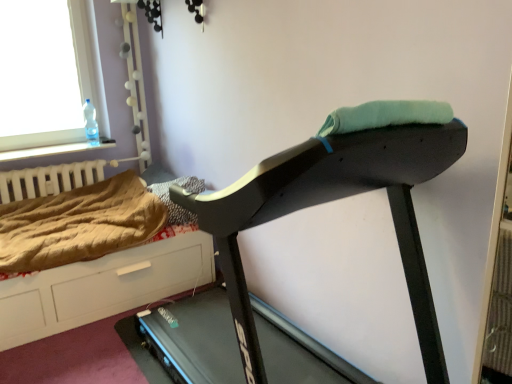
Question: In which direction should I rotate to look at brown textured blanket at center, which is the second blanket from left to right?

Choices:
 (A) left
 (B) right

Answer: (A)

Question: Is transparent glass window at upper left directly adjacent to brown wood dresser at lower left?

Choices:
 (A) no
 (B) yes

Answer: (A)

Question: Is transparent glass window at upper left positioned far away from brown wood dresser at lower left?

Choices:
 (A) no
 (B) yes

Answer: (B)

Question: Does transparent glass window at upper left have a larger size compared to brown wood dresser at lower left?

Choices:
 (A) no
 (B) yes

Answer: (A)

Question: Does transparent glass window at upper left have a lesser width compared to brown wood dresser at lower left?

Choices:
 (A) no
 (B) yes

Answer: (B)

Question: Does transparent glass window at upper left have a lesser height compared to brown wood dresser at lower left?

Choices:
 (A) no
 (B) yes

Answer: (A)

Question: Would you say transparent glass window at upper left contains brown wood dresser at lower left?

Choices:
 (A) no
 (B) yes

Answer: (A)

Question: Is brown textured blanket at center, which is the second blanket from left to right, looking in the opposite direction of brown textured blanket at left, which is counted as the first blanket, starting from the left?

Choices:
 (A) yes
 (B) no

Answer: (B)

Question: Does brown textured blanket at center, which is the second blanket from left to right, touch brown textured blanket at left, which is counted as the first blanket, starting from the left?

Choices:
 (A) no
 (B) yes

Answer: (A)

Question: Is brown textured blanket at center, which is the second blanket from left to right, in front of brown textured blanket at left, which is counted as the first blanket, starting from the left?

Choices:
 (A) yes
 (B) no

Answer: (B)

Question: Is brown textured blanket at center, which appears as the first blanket when viewed from the right, oriented towards brown textured blanket at left, which is counted as the first blanket, starting from the left?

Choices:
 (A) yes
 (B) no

Answer: (A)

Question: Would you say brown textured blanket at center, which appears as the first blanket when viewed from the right, contains brown textured blanket at left, placed as the second blanket when sorted from right to left?

Choices:
 (A) yes
 (B) no

Answer: (B)

Question: Is brown textured blanket at center, which appears as the first blanket when viewed from the right, thinner than brown textured blanket at left, which is counted as the first blanket, starting from the left?

Choices:
 (A) yes
 (B) no

Answer: (A)

Question: Is brown textured blanket at center, which is the second blanket from left to right, at the right side of brown wood dresser at lower left?

Choices:
 (A) yes
 (B) no

Answer: (A)